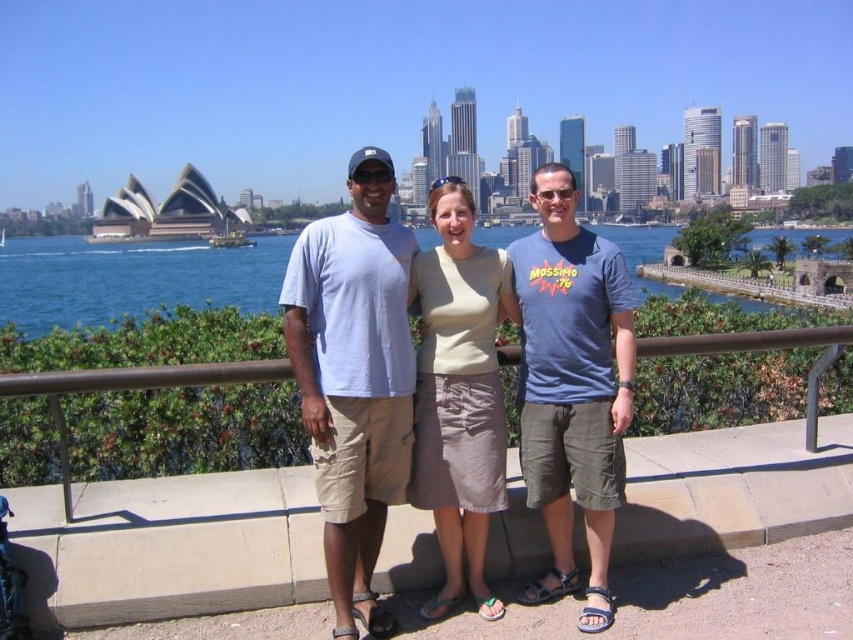
Can you confirm if light blue cotton shirt at center is shorter than blue water at center?

Incorrect, light blue cotton shirt at center's height does not fall short of blue water at center's.

Is point (305, 412) positioned after point (80, 262)?

No, (305, 412) is in front of (80, 262).

What do you see at coordinates (352, 384) in the screenshot?
I see `light blue cotton shirt at center` at bounding box center [352, 384].

Image resolution: width=853 pixels, height=640 pixels. Find the location of `light blue cotton shirt at center`. light blue cotton shirt at center is located at coordinates (352, 384).

Is point (485, 349) less distant than point (207, 296)?

Yes, it is in front of point (207, 296).

Does beige cotton skirt at center have a lesser width compared to blue water at center?

Yes, beige cotton skirt at center is thinner than blue water at center.

Locate an element on the screen. beige cotton skirt at center is located at coordinates (459, 394).

Is light blue cotton shirt at center below light blue cotton t-shirt at center?

Correct, light blue cotton shirt at center is located below light blue cotton t-shirt at center.

Is light blue cotton shirt at center to the right of light blue cotton t-shirt at center from the viewer's perspective?

Indeed, light blue cotton shirt at center is positioned on the right side of light blue cotton t-shirt at center.

Locate an element on the screen. The image size is (853, 640). light blue cotton shirt at center is located at coordinates (352, 384).

What are the coordinates of `light blue cotton shirt at center` in the screenshot? It's located at (352, 384).